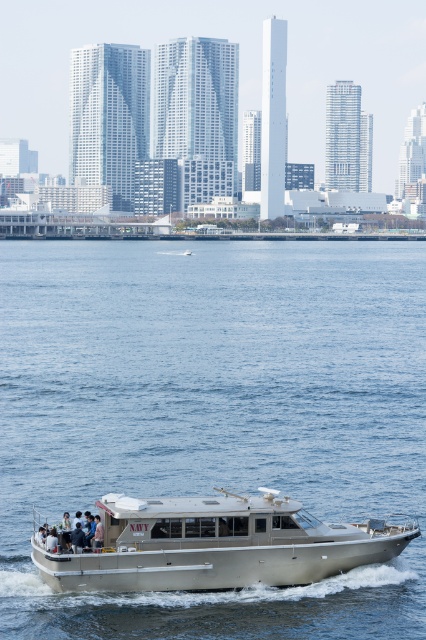
In the scene shown: Between blue water at center and metallic silver boat at center, which one appears on the right side from the viewer's perspective?

metallic silver boat at center is more to the right.

Is blue water at center to the right of metallic silver boat at center from the viewer's perspective?

Incorrect, blue water at center is not on the right side of metallic silver boat at center.

Is point (333, 390) behind point (377, 541)?

Yes, it is.

Identify the location of blue water at center. The height and width of the screenshot is (640, 426). (213, 417).